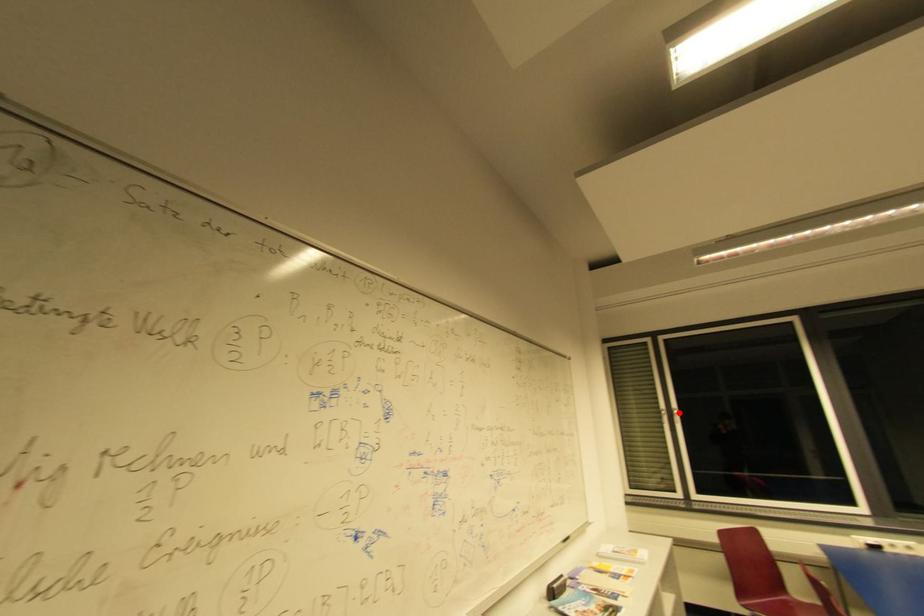
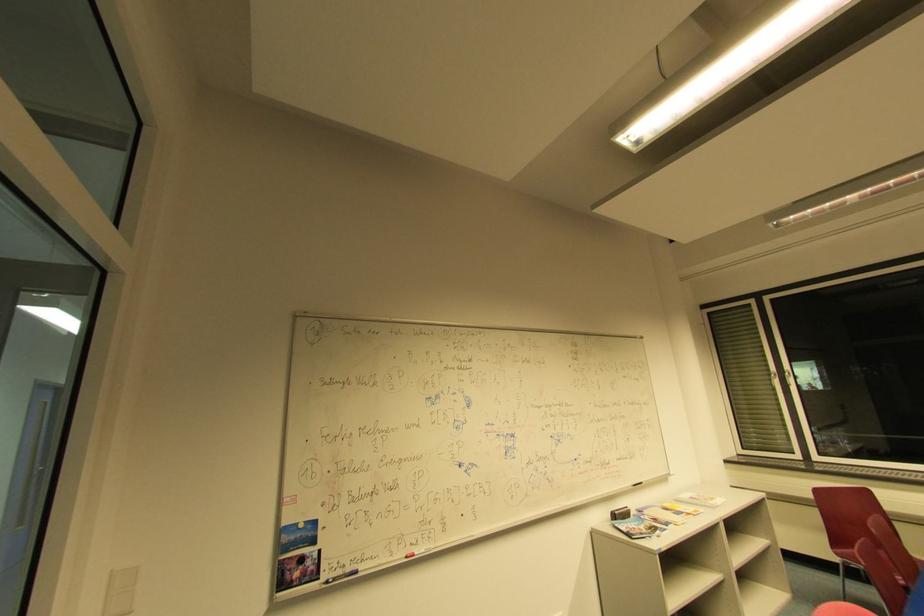
Question: I am providing you with two images of the same scene from different viewpoints. Image1 has a red point marked. In image2, the corresponding 3D location appears at what relative position? Reply with the corresponding letter.

Choices:
 (A) Closer
 (B) Farther

Answer: (A)